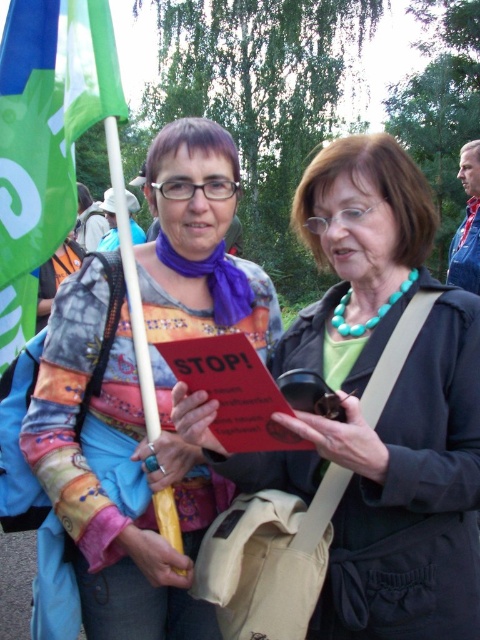
You are a photographer trying to capture a candid shot of both the matte black jacket at center and the multicolored patchwork shirt at center in the same frame. Since you want to ensure both are fully visible, which clothing item should you focus on adjusting your camera angle to include first?

The matte black jacket at center is shorter than the multicolored patchwork shirt at center, so you should focus on adjusting your camera angle to include the shorter matte black jacket at center first to ensure both are fully visible.

You are organizing a charity event and need to decide which clothing item to use as a backdrop. The matte black jacket at center and the multicolored patchwork shirt at center are available. Which one is larger and better suited for a backdrop?

The multicolored patchwork shirt at center is larger than the matte black jacket at center, making it better suited for a backdrop.

Consider the image. You are a photographer trying to capture both the matte black jacket at center and the green fabric flag at left in a single frame. Based on their sizes, which object should you focus on first to ensure both are in the frame?

The matte black jacket at center has a greater height compared to the green fabric flag at left, so you should focus on the matte black jacket at center first to ensure both fit within the frame.